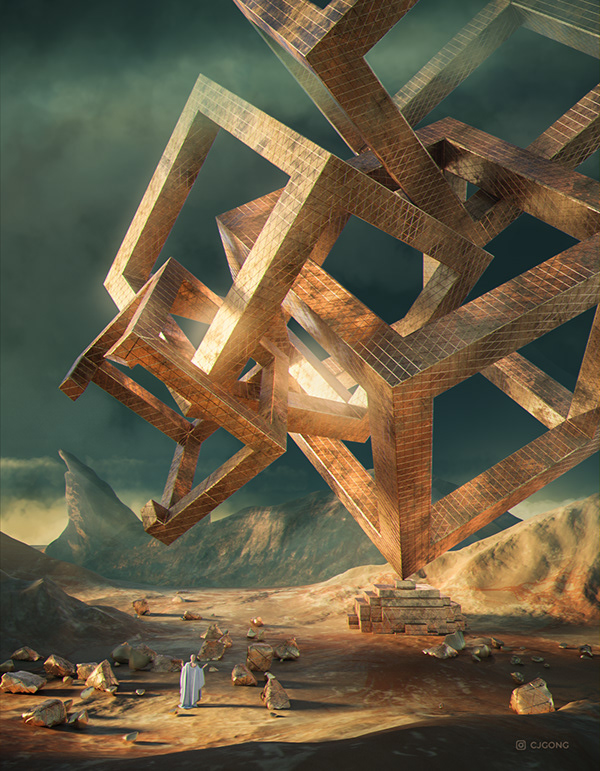
This screenshot has width=600, height=771. Identify the location of robe. (192, 681).